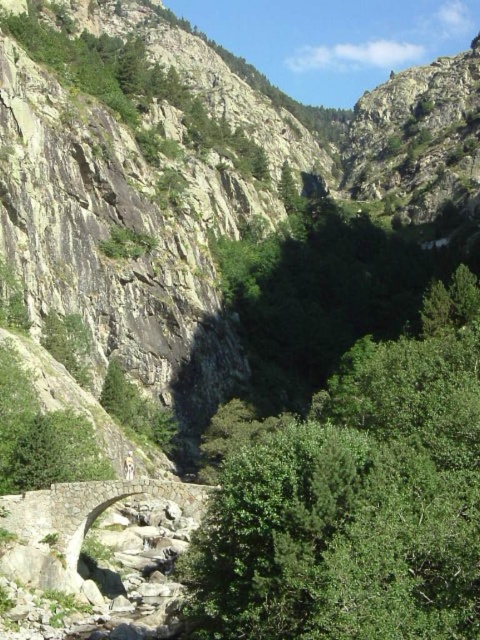
Question: From the image, what is the correct spatial relationship of green leafy tree at center in relation to stone bridge at center?

Choices:
 (A) above
 (B) below

Answer: (A)

Question: Does green leafy tree at center appear on the left side of stone bridge at center?

Choices:
 (A) no
 (B) yes

Answer: (A)

Question: Which point is closer to the camera?

Choices:
 (A) stone bridge at center
 (B) green leafy tree at center

Answer: (B)

Question: Which point appears farthest from the camera in this image?

Choices:
 (A) (71, 557)
 (B) (446, 435)

Answer: (A)

Question: Is green leafy tree at center behind stone bridge at center?

Choices:
 (A) no
 (B) yes

Answer: (A)

Question: Which point appears farthest from the camera in this image?

Choices:
 (A) (91, 513)
 (B) (417, 628)

Answer: (A)